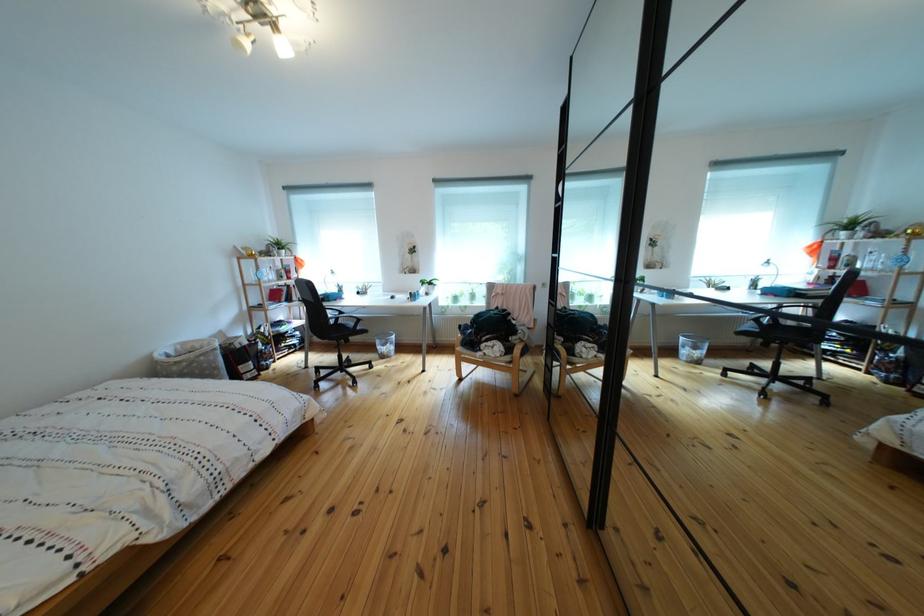
I want to click on grey fabric basket, so click(x=189, y=360).